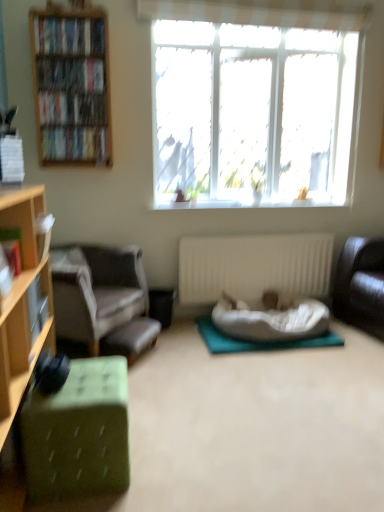
Question: Considering the positions of green fabric footrest at lower left and white ribbed radiator at center in the image, is green fabric footrest at lower left taller or shorter than white ribbed radiator at center?

Choices:
 (A) tall
 (B) short

Answer: (B)

Question: Considering the relative positions of green fabric footrest at lower left and white ribbed radiator at center in the image provided, is green fabric footrest at lower left to the left or to the right of white ribbed radiator at center?

Choices:
 (A) right
 (B) left

Answer: (B)

Question: Based on their relative distances, which object is nearer to the hardcover book at left, the 2th book ordered from the bottom?

Choices:
 (A) white ribbed radiator at center
 (B) hardcover book at upper left, positioned as the third book in bottom-to-top order
 (C) transparent glass window at upper center
 (D) matte black bookshelf at upper left, arranged as the 4th book when ordered from the bottom
 (E) gray fabric chair at left

Answer: (E)

Question: Considering the real-world distances, which object is farthest from the teal fabric yoga mat at center?

Choices:
 (A) hardcover books at left, which is the third book from back to front
 (B) matte black bookshelf at upper left, which appears as the 2th book when viewed from the back
 (C) hardcover book at left, acting as the fifth book starting from the top
 (D) leather couch at right
 (E) green fabric ottoman at lower left, arranged as the first cabinetry when ordered from the bottom

Answer: (A)